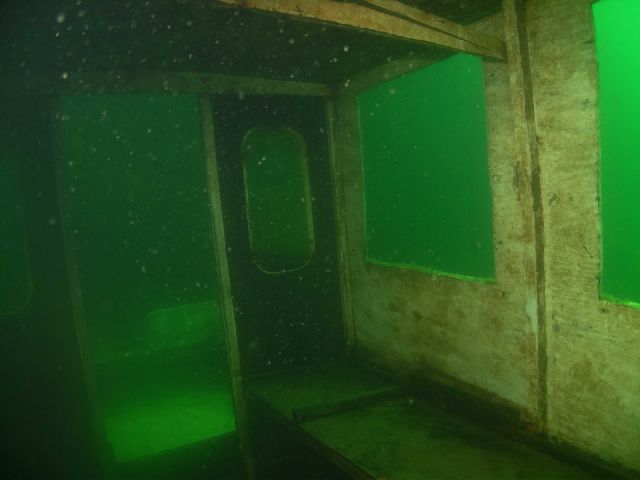
The image size is (640, 480). In order to click on seat separator in this screenshot , I will do `click(305, 408)`.